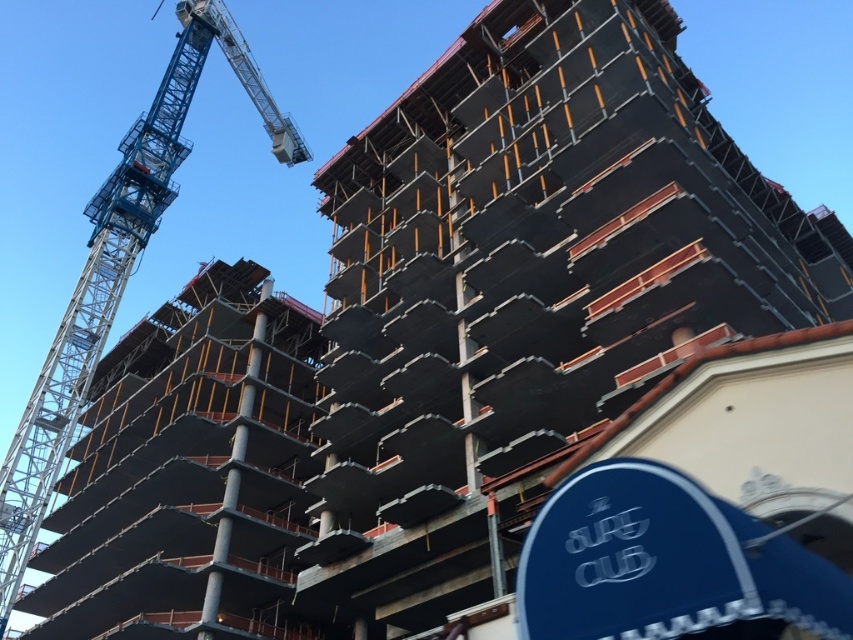
Question: Is concrete scaffolding at center to the left of blue metallic crane at upper left from the viewer's perspective?

Choices:
 (A) yes
 (B) no

Answer: (B)

Question: Which object is farther from the camera taking this photo?

Choices:
 (A) concrete scaffolding at center
 (B) blue metallic crane at upper left

Answer: (B)

Question: Can you confirm if concrete scaffolding at center is positioned to the right of blue metallic crane at upper left?

Choices:
 (A) yes
 (B) no

Answer: (A)

Question: Which of the following is the closest to the observer?

Choices:
 (A) (532, 227)
 (B) (140, 193)

Answer: (A)

Question: Can you confirm if concrete scaffolding at center is positioned to the left of blue metallic crane at upper left?

Choices:
 (A) yes
 (B) no

Answer: (B)

Question: Which object appears farthest from the camera in this image?

Choices:
 (A) concrete scaffolding at center
 (B) blue metallic crane at upper left

Answer: (B)